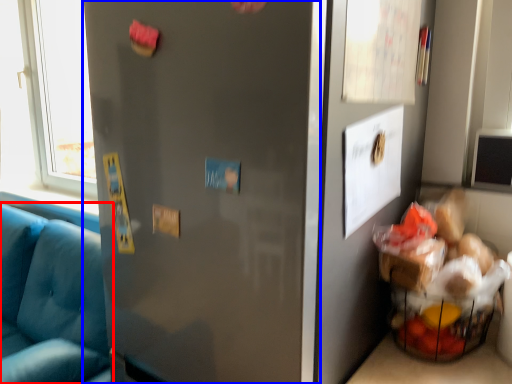
Question: Which point is further to the camera, studio couch (highlighted by a red box) or door (highlighted by a blue box)?

Choices:
 (A) studio couch
 (B) door

Answer: (A)